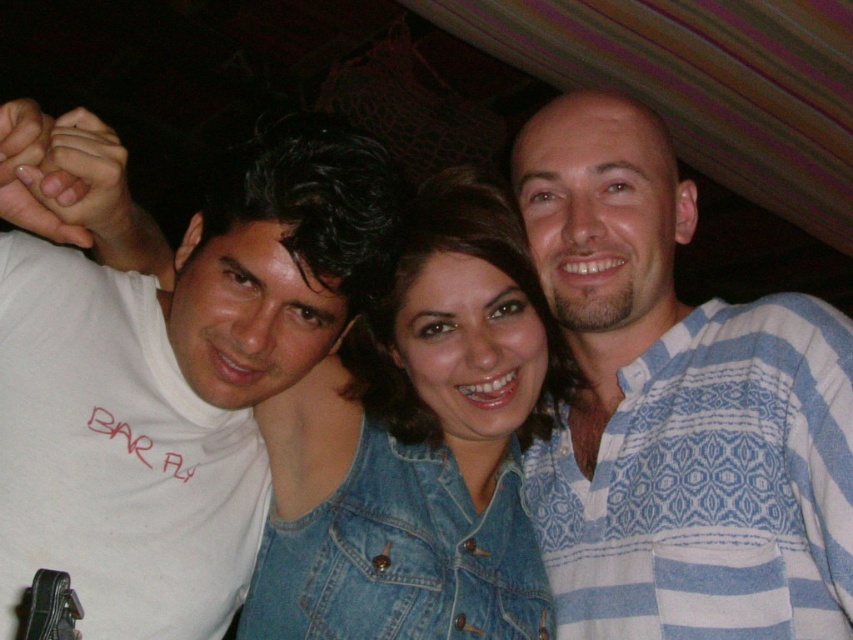
You are a photographer trying to adjust the lighting for a group photo. You notice the blue striped shirt at right and the denim jacket at center. Which clothing item is closer to the camera?

The blue striped shirt at right is positioned over the denim jacket at center, meaning it is closer to the camera.

You are standing at the origin of the coordinate system in the image. The blue striped shirt at right is located at point (677, 410). If you want to move towards the blue striped shirt at right, which direction should you move in terms of x and y coordinates?

To move towards the blue striped shirt at right located at coordinates (677, 410), you should move in the positive x and positive y direction since the shirt is at higher x and y coordinates compared to the origin.